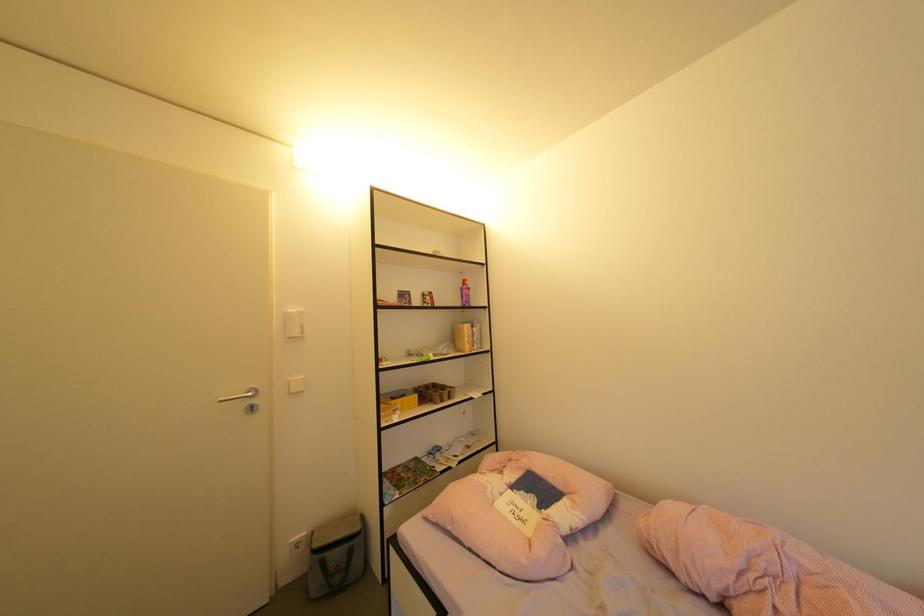
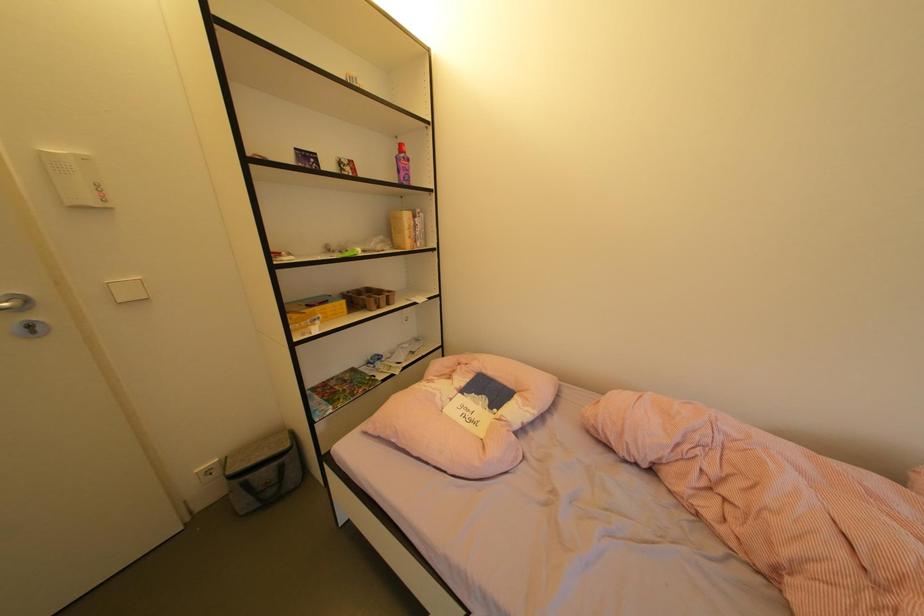
Question: The images are taken continuously from a first-person perspective. In which direction are you moving?

Choices:
 (A) Left
 (B) Right
 (C) Forward
 (D) Backward

Answer: (C)